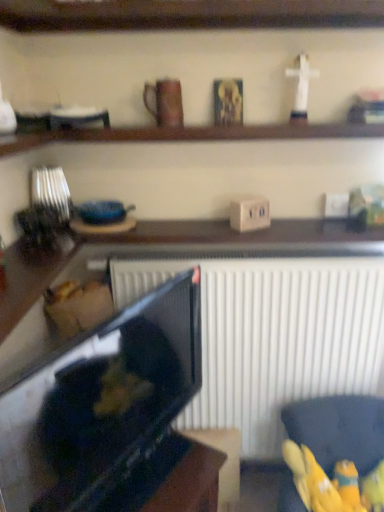
Locate an element on the screen. This screenshot has width=384, height=512. free area below wooden shelf at upper center, the 2th shelf when ordered from top to bottom (from a real-world perspective) is located at coordinates (238, 226).